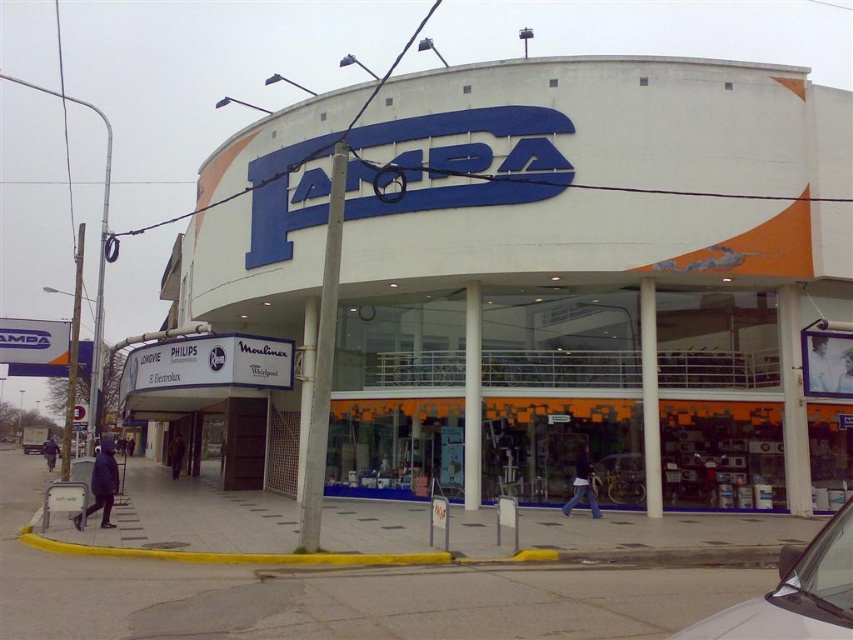
From the picture: You are standing in front of the Pampa store and want to determine the relative positions of two points on the building facade. The first point is at coordinate point (843, 122) and the second is at point (827, 557). Which point is closer to you?

Point (843, 122) is further to the viewer than point (827, 557). Therefore, the point at (827, 557) is closer to you.

You are a delivery driver who needs to park your white glossy car at lower right near the white glossy building at center. Considering their sizes, will the car fit under the covered walkway extending from the building?

The white glossy building at center is much taller than the white glossy car at lower right, so the car should fit under the covered walkway since it is shorter than the building.

You are a customer arriving at the Pampa store. You see the white glossy building at center and the white glossy car at lower right. Which object is closer to you as you approach the entrance?

The white glossy building at center is closer to you because the white glossy car at lower right is positioned behind it.